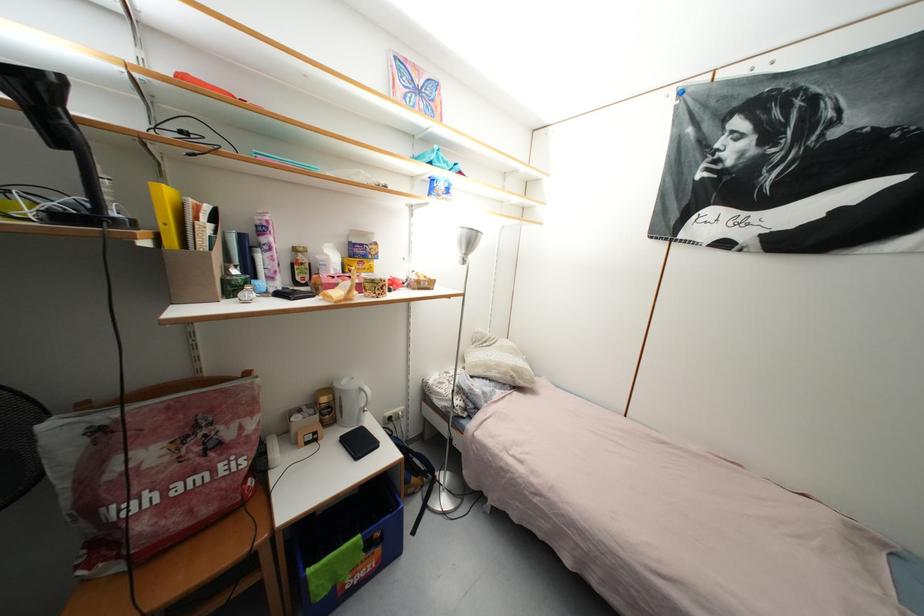
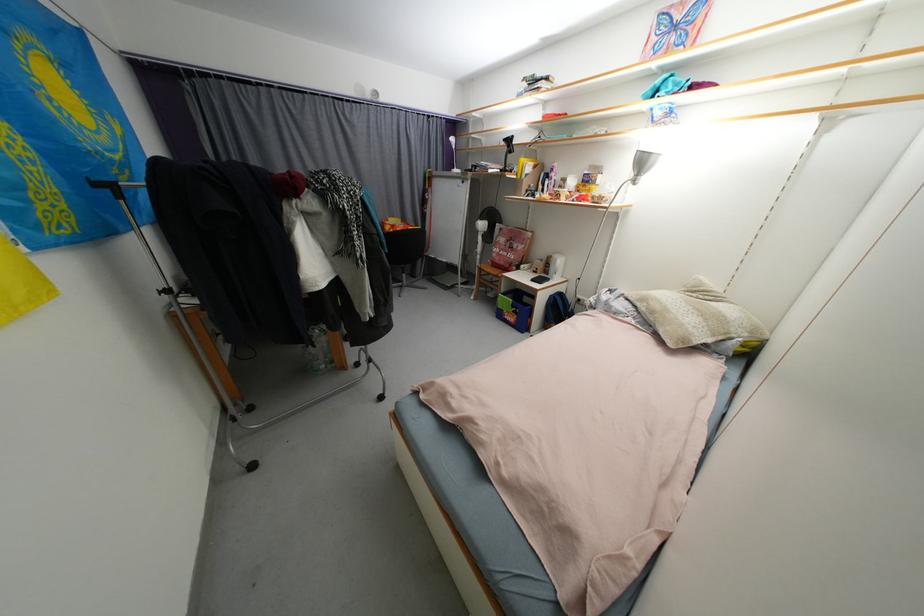
Find the pixel in the second image that matches (x=234, y=436) in the first image.

(520, 248)